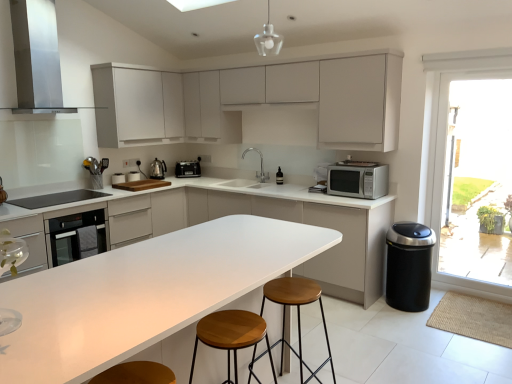
Find the location of a particular element. blank space situated above black glass cooktop at left (from a real-world perspective) is located at coordinates (51, 198).